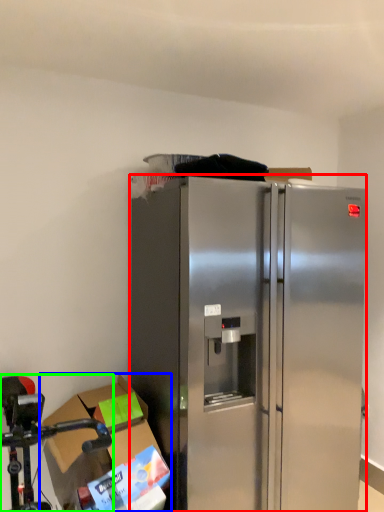
Question: Which is farther away from refrigerator (highlighted by a red box)? cardboard box (highlighted by a blue box) or stainless steel (highlighted by a green box)?

Choices:
 (A) cardboard box
 (B) stainless steel

Answer: (B)